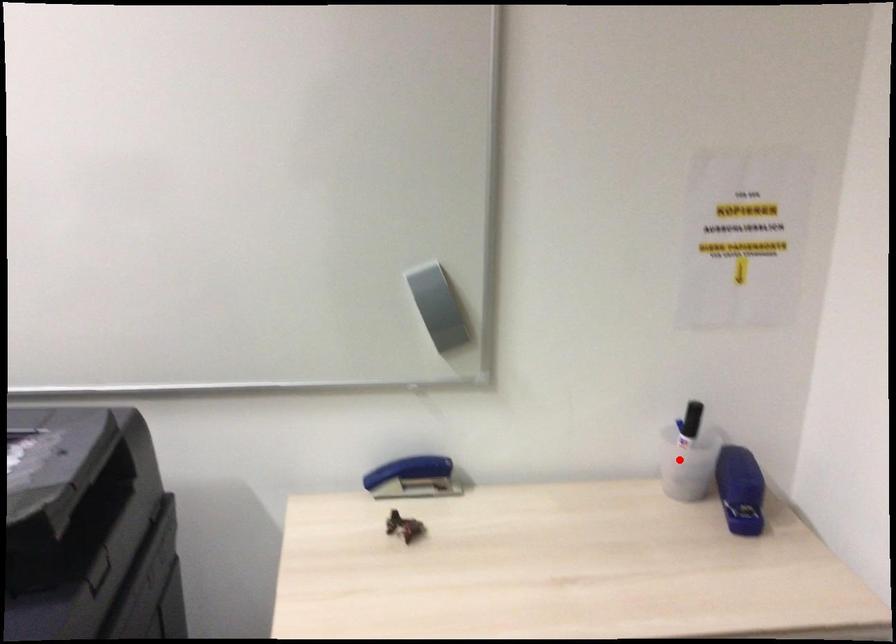
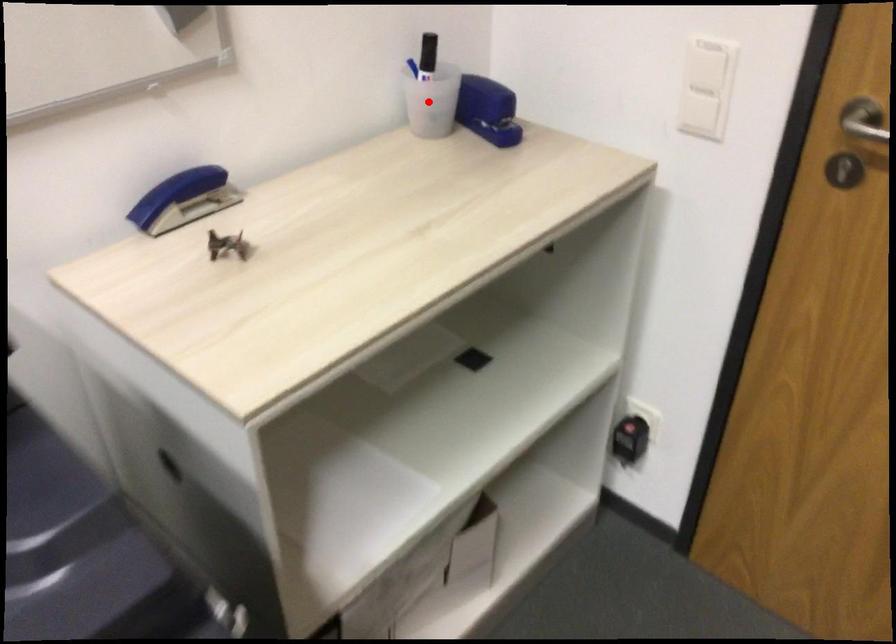
I am providing you with two images of the same scene from different viewpoints. A red point is marked on the first image and another point is marked on the second image. Is the red point in image1 aligned with the point shown in image2?

Yes